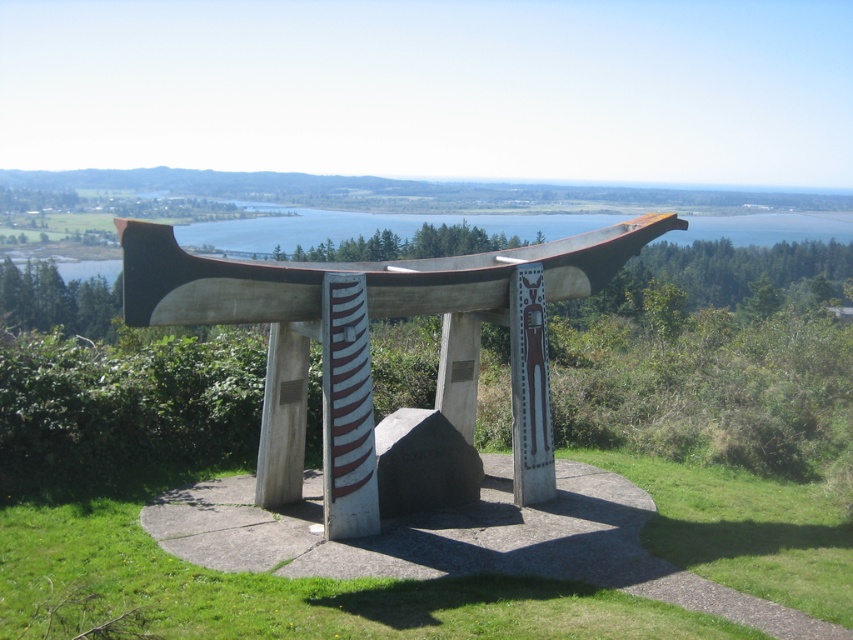
Is green grass at center below polished wood bench at center?

Correct, green grass at center is located below polished wood bench at center.

Find the location of a particular element. green grass at center is located at coordinates (299, 589).